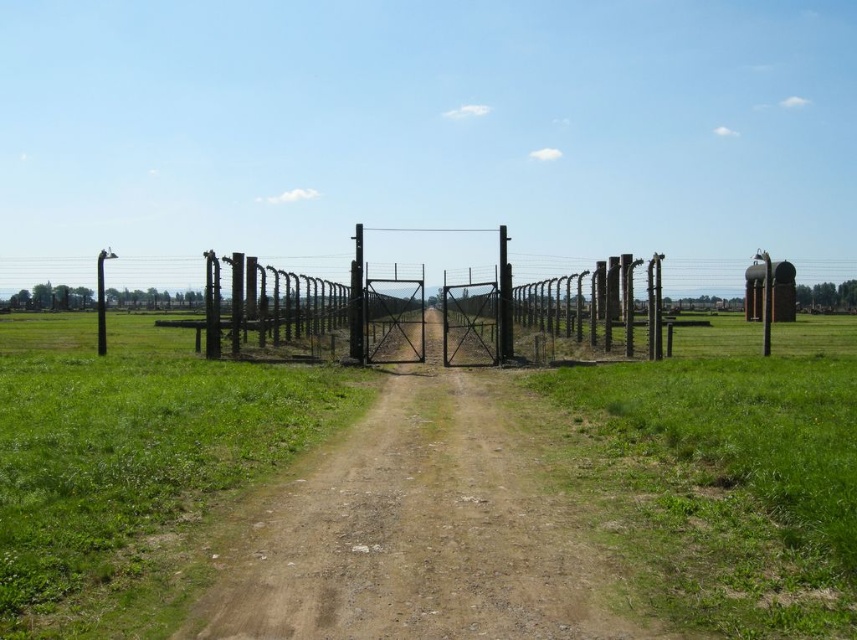
You are a hiker carrying a 10 meter long ladder. You see the brown dirt track at center and the black metal pole at center in the distance. Can you safely carry the ladder horizontally from the dirt track to the pole without tilting it?

The distance between the brown dirt track at center and the black metal pole at center is 10.59 meters. Since the ladder is 10 meters long, which is shorter than the distance between them, you can safely carry the ladder horizontally without tilting it.

You are a hiker walking along the brown dirt track at center and notice the black metal pole at left nearby. Which object takes up less space in the image?

The brown dirt track at center takes up less space compared to the black metal pole at left, as it has a smaller size.

You are standing on the brown dirt track at center and looking towards the black metal pole at left. Which direction should you walk to move away from the pole?

Since the brown dirt track at center is below the black metal pole at left, walking forward along the track will take you away from the pole.